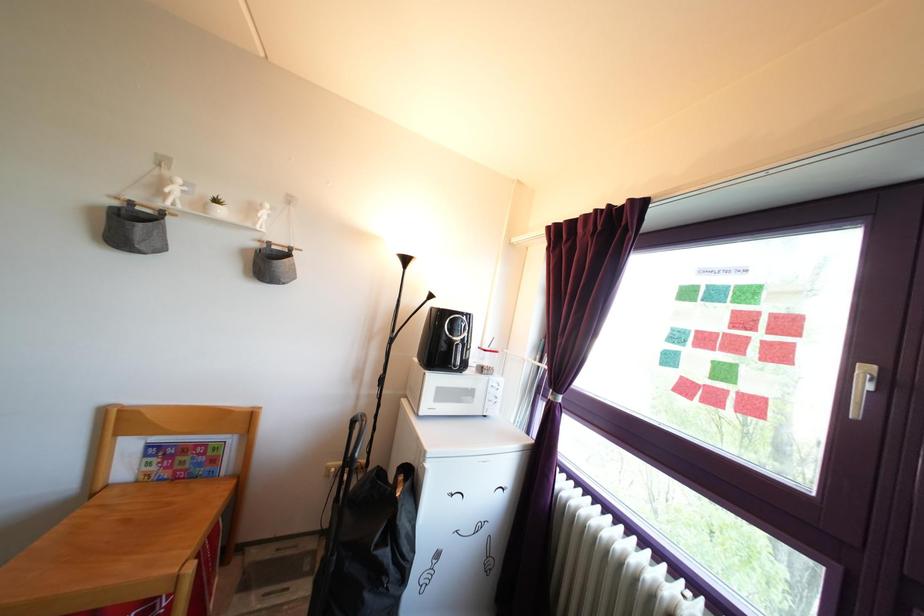
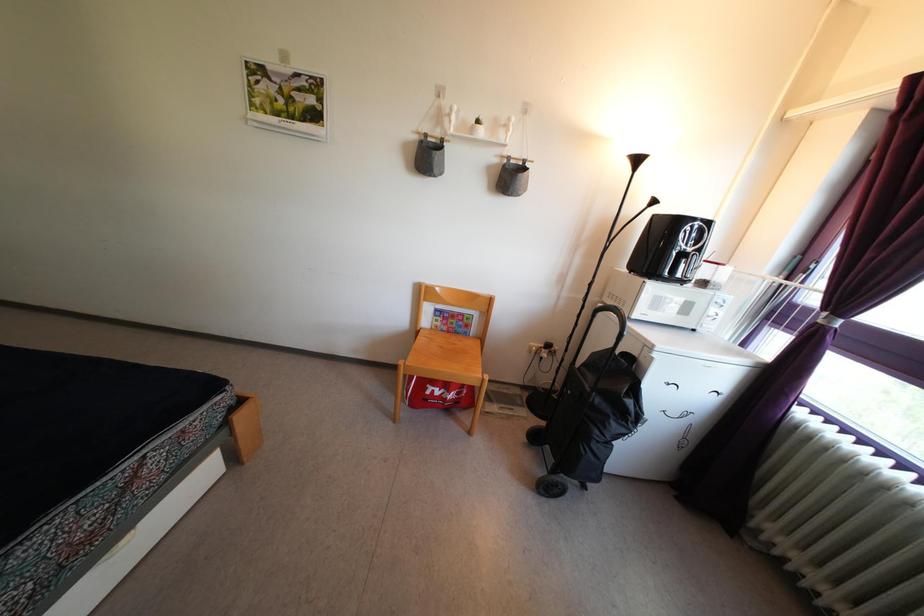
How did the camera likely rotate?

The rotation direction of the camera is left-down.